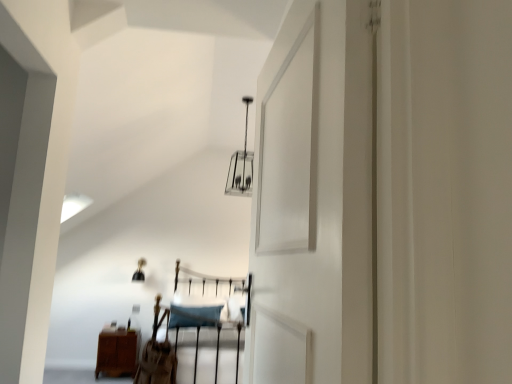
Question: Is metallic silver light fixture at upper center inside brown wood nightstand at lower left?

Choices:
 (A) yes
 (B) no

Answer: (B)

Question: Considering the relative sizes of brown wood nightstand at lower left and metallic silver light fixture at upper center in the image provided, is brown wood nightstand at lower left thinner than metallic silver light fixture at upper center?

Choices:
 (A) no
 (B) yes

Answer: (B)

Question: From the image's perspective, is brown wood nightstand at lower left located beneath metallic silver light fixture at upper center?

Choices:
 (A) yes
 (B) no

Answer: (A)

Question: Can we say brown wood nightstand at lower left lies outside metallic silver light fixture at upper center?

Choices:
 (A) no
 (B) yes

Answer: (B)

Question: Is brown wood nightstand at lower left looking in the opposite direction of metallic silver light fixture at upper center?

Choices:
 (A) no
 (B) yes

Answer: (A)

Question: In terms of size, does brown wood nightstand at lower left appear bigger or smaller than metallic silver light fixture at upper center?

Choices:
 (A) big
 (B) small

Answer: (B)

Question: Does point (132, 337) appear closer or farther from the camera than point (245, 148)?

Choices:
 (A) farther
 (B) closer

Answer: (A)

Question: From the image's perspective, relative to metallic silver light fixture at upper center, is brown wood nightstand at lower left above or below?

Choices:
 (A) below
 (B) above

Answer: (A)

Question: In terms of width, does brown wood nightstand at lower left look wider or thinner when compared to metallic silver light fixture at upper center?

Choices:
 (A) thin
 (B) wide

Answer: (A)

Question: Considering the positions of point (169, 372) and point (132, 331), is point (169, 372) closer or farther from the camera than point (132, 331)?

Choices:
 (A) closer
 (B) farther

Answer: (A)

Question: From a real-world perspective, relative to brown wood nightstand at lower left, is brown leather chair at center vertically above or below?

Choices:
 (A) above
 (B) below

Answer: (A)

Question: From the image's perspective, is brown leather chair at center located above or below brown wood nightstand at lower left?

Choices:
 (A) below
 (B) above

Answer: (B)

Question: Considering the positions of brown leather chair at center and brown wood nightstand at lower left in the image, is brown leather chair at center taller or shorter than brown wood nightstand at lower left?

Choices:
 (A) tall
 (B) short

Answer: (A)

Question: In the image, is brown wood nightstand at lower left positioned in front of or behind brown leather chair at center?

Choices:
 (A) front
 (B) behind

Answer: (B)

Question: Considering the positions of point (133, 370) and point (158, 374), is point (133, 370) closer or farther from the camera than point (158, 374)?

Choices:
 (A) farther
 (B) closer

Answer: (A)